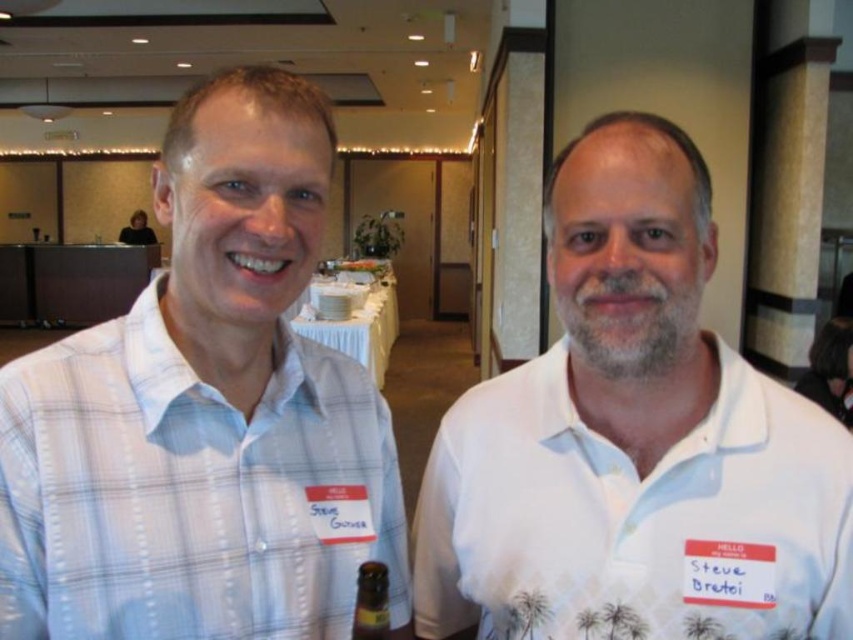
Based on the photo, is white cotton polo shirt at right taller than brown glass bottle at center?

Yes, white cotton polo shirt at right is taller than brown glass bottle at center.

Is white cotton polo shirt at right smaller than brown glass bottle at center?

Incorrect, white cotton polo shirt at right is not smaller in size than brown glass bottle at center.

Describe the element at coordinates (633, 442) in the screenshot. I see `white cotton polo shirt at right` at that location.

In order to click on white cotton polo shirt at right in this screenshot , I will do `click(633, 442)`.

Does light blue plaid shirt at left have a greater height compared to white cotton polo shirt at right?

Yes, light blue plaid shirt at left is taller than white cotton polo shirt at right.

Can you confirm if light blue plaid shirt at left is smaller than white cotton polo shirt at right?

Yes, light blue plaid shirt at left is smaller than white cotton polo shirt at right.

The height and width of the screenshot is (640, 853). I want to click on light blue plaid shirt at left, so click(206, 413).

Is light blue plaid shirt at left below brown glass bottle at center?

No.

Looking at this image, is light blue plaid shirt at left bigger than brown glass bottle at center?

Yes.

Locate an element on the screen. light blue plaid shirt at left is located at coordinates (206, 413).